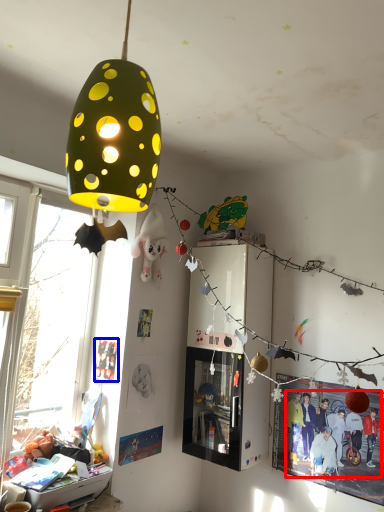
Question: Which object is closer to the camera taking this photo, person (highlighted by a red box) or poster page (highlighted by a blue box)?

Choices:
 (A) person
 (B) poster page

Answer: (A)